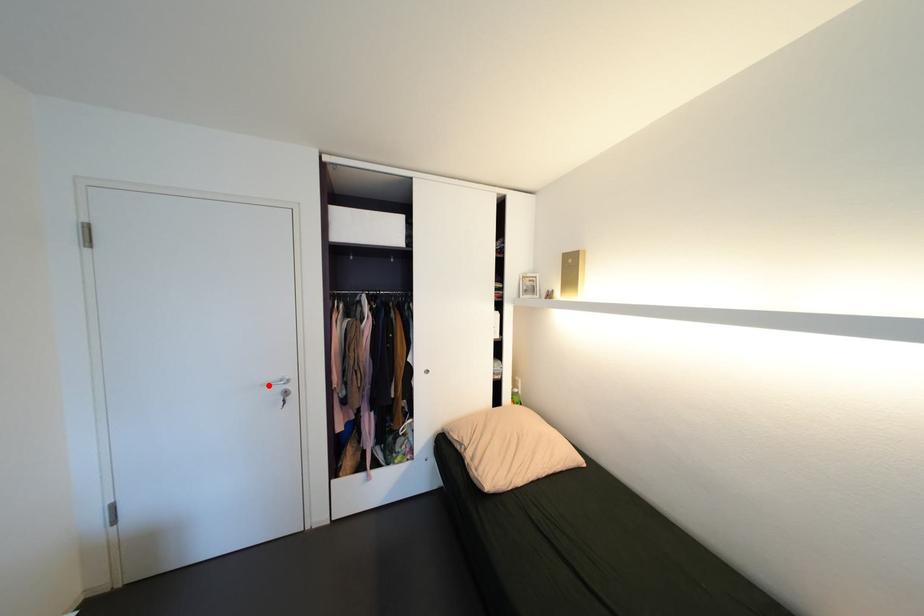
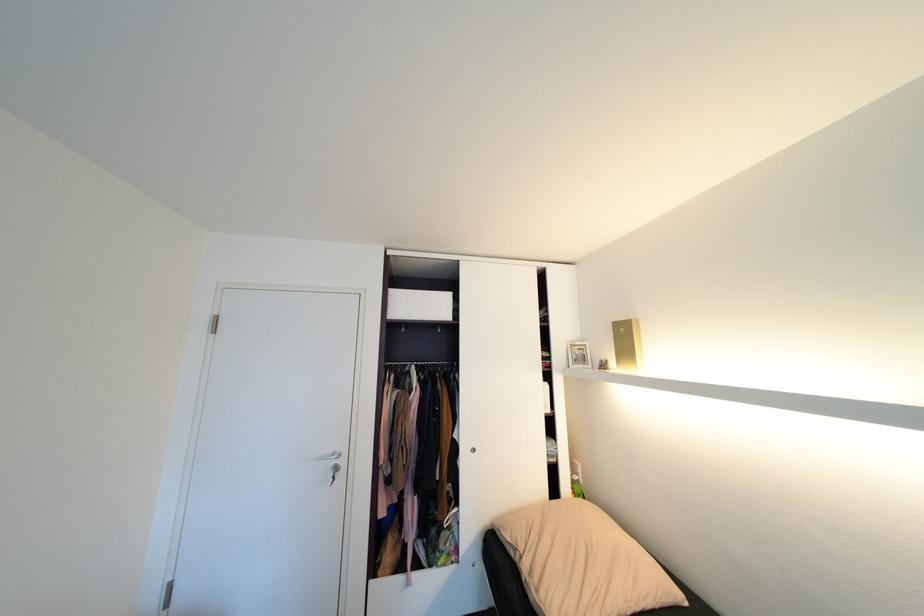
Where in the second image is the point corresponding to the highlighted location from the first image?

(322, 459)